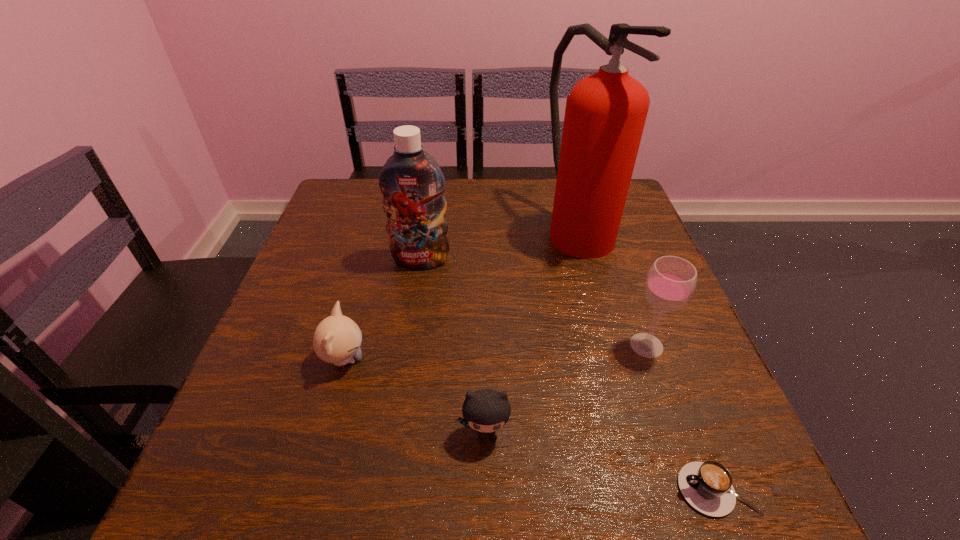
At what (x,y) coordinates should I click in order to perform the action: click on vacant space at the far left corner of the desktop. Please return your answer as a coordinate pair (x, y). This screenshot has height=540, width=960. Looking at the image, I should click on (385, 214).

Find the location of `free region at the near left corner`. free region at the near left corner is located at coordinates (302, 458).

This screenshot has width=960, height=540. Find the location of `free point between the second tallest object and the wineglass`. free point between the second tallest object and the wineglass is located at coordinates (534, 303).

The width and height of the screenshot is (960, 540). I want to click on free area in between the nearest object and the third tallest object, so click(x=682, y=417).

You are a GUI agent. You are given a task and a screenshot of the screen. Output one action in this format:
    pyautogui.click(x=<x>, y=<y>)
    Task: Click on the vacant space in between the nearer kitten and the wineglass
    The height and width of the screenshot is (540, 960).
    Given the screenshot: What is the action you would take?
    pyautogui.click(x=566, y=389)

Identify the location of free space between the tallest object and the third object from left to right. (532, 331).

What are the coordinates of `blank region between the fifth shortest object and the cappuccino` in the screenshot? It's located at (568, 375).

Identify the location of blank region between the tallest object and the third tallest object. Image resolution: width=960 pixels, height=540 pixels. (612, 287).

You are a GUI agent. You are given a task and a screenshot of the screen. Output one action in this format:
    pyautogui.click(x=<x>, y=<y>)
    Task: Click on the free spot between the nearest object and the tallest object
    The width and height of the screenshot is (960, 540).
    Given the screenshot: What is the action you would take?
    pyautogui.click(x=647, y=359)

I want to click on free space between the leftmost object and the right kitten, so click(x=415, y=396).